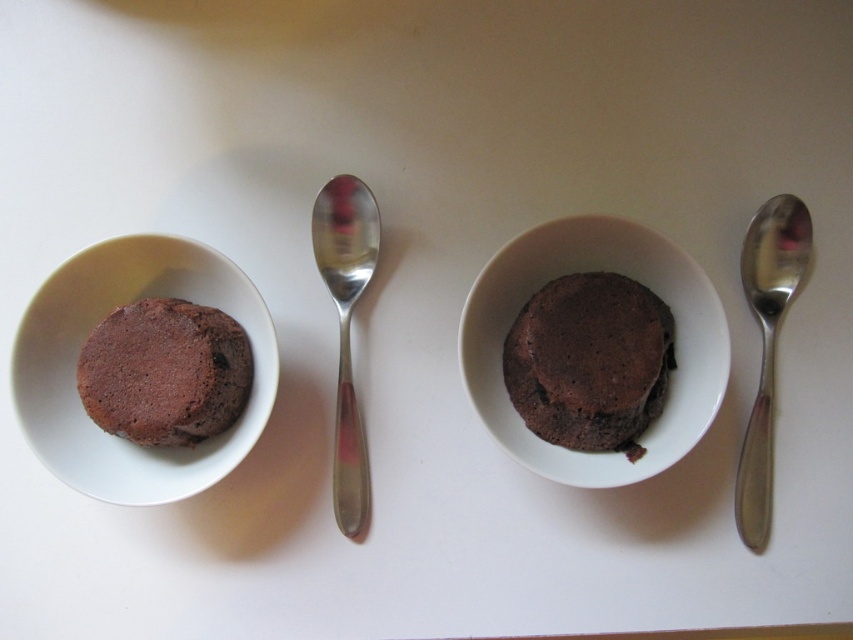
Question: Which is nearer to the chocolate matte cake at left?

Choices:
 (A) polished silver spoon at right
 (B) matte ceramic bowl at center
 (C) chocolate matte cake at center

Answer: (B)

Question: Is matte ceramic bowl at center smaller than chocolate matte cake at left?

Choices:
 (A) yes
 (B) no

Answer: (B)

Question: Which point is farther from the camera taking this photo?

Choices:
 (A) (257, 438)
 (B) (212, 314)

Answer: (B)

Question: Is matte ceramic bowl at center below chocolate matte cake at left?

Choices:
 (A) yes
 (B) no

Answer: (B)

Question: Is matte ceramic bowl at left above chocolate matte cake at center?

Choices:
 (A) no
 (B) yes

Answer: (A)

Question: Considering the real-world distances, which object is farthest from the matte ceramic bowl at left?

Choices:
 (A) matte ceramic bowl at center
 (B) chocolate matte cake at left

Answer: (A)